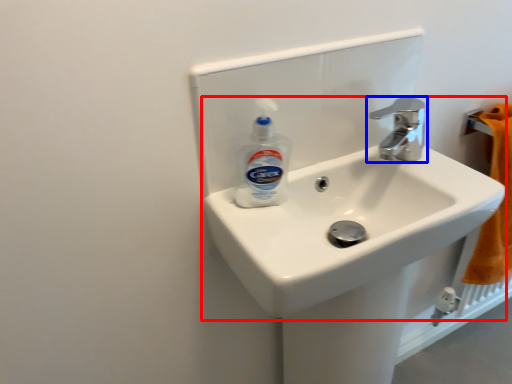
Question: Which of the following is the farthest to the observer, sink (highlighted by a red box) or tap (highlighted by a blue box)?

Choices:
 (A) sink
 (B) tap

Answer: (B)